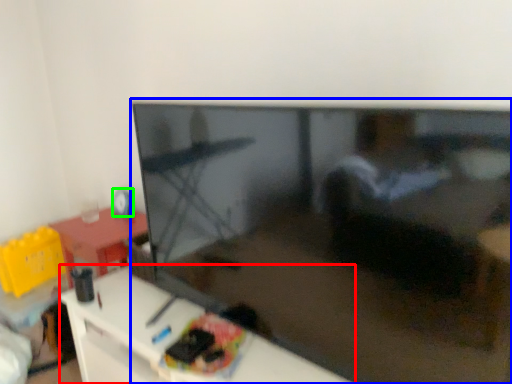
Question: Considering the real-world distances, which object is closest to furniture (highlighted by a red box)? television (highlighted by a blue box) or toy (highlighted by a green box).

Choices:
 (A) television
 (B) toy

Answer: (A)